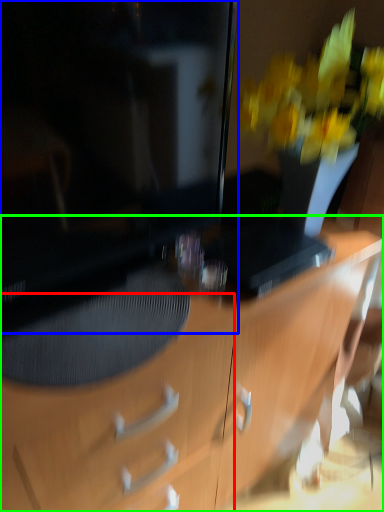
Question: Based on their relative distances, which object is nearer to drawer (highlighted by a red box)? Choose from television (highlighted by a blue box) and desk (highlighted by a green box).

Choices:
 (A) television
 (B) desk

Answer: (B)